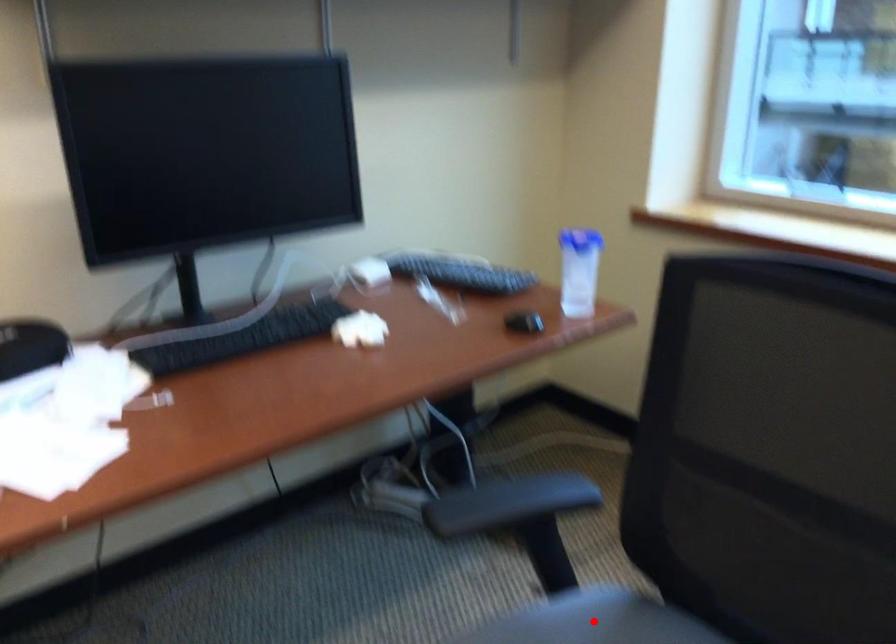
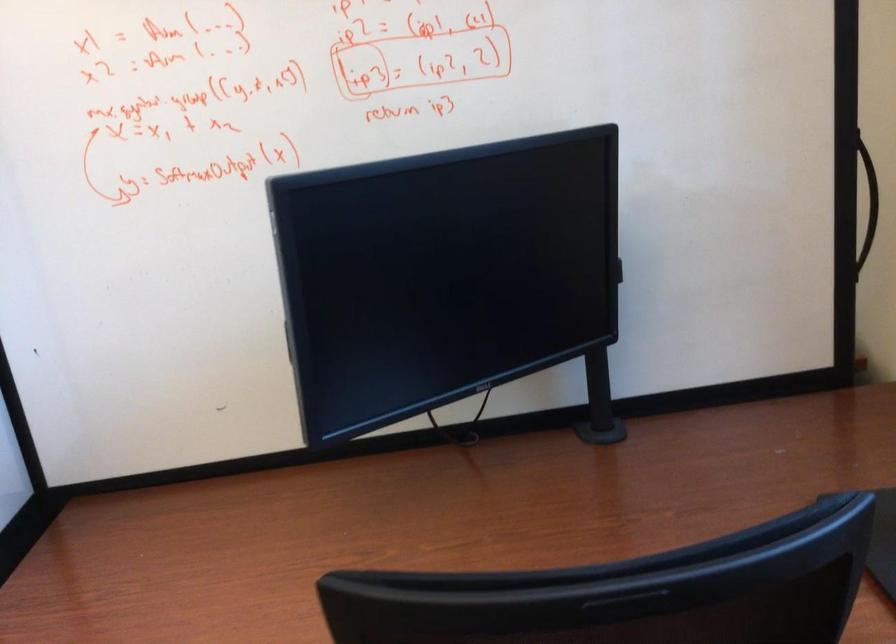
Question: I am providing you with two images of the same scene from different viewpoints. A red point is marked on the first image. At the location where the point appears in image 1, is it still visible in image 2?

Choices:
 (A) Yes
 (B) No

Answer: (B)